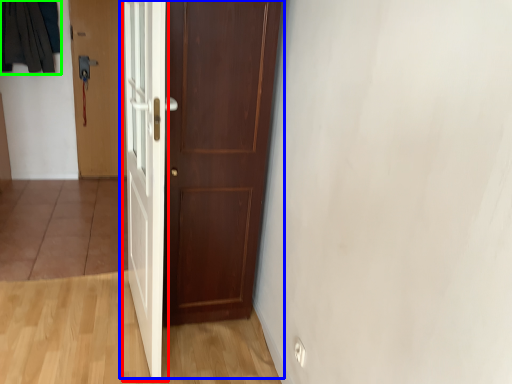
Question: Based on their relative distances, which object is nearer to door (highlighted by a red box)? Choose from door (highlighted by a blue box) and clothing (highlighted by a green box).

Choices:
 (A) door
 (B) clothing

Answer: (A)